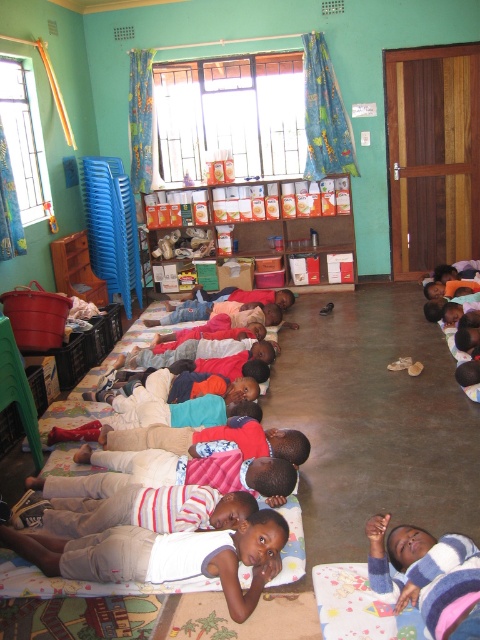
Is light brown cotton shorts at center above striped knit sweater at lower right?

No, light brown cotton shorts at center is not above striped knit sweater at lower right.

Does point (239, 602) come behind point (389, 557)?

That is False.

Find the location of a particular element. light brown cotton shorts at center is located at coordinates (167, 556).